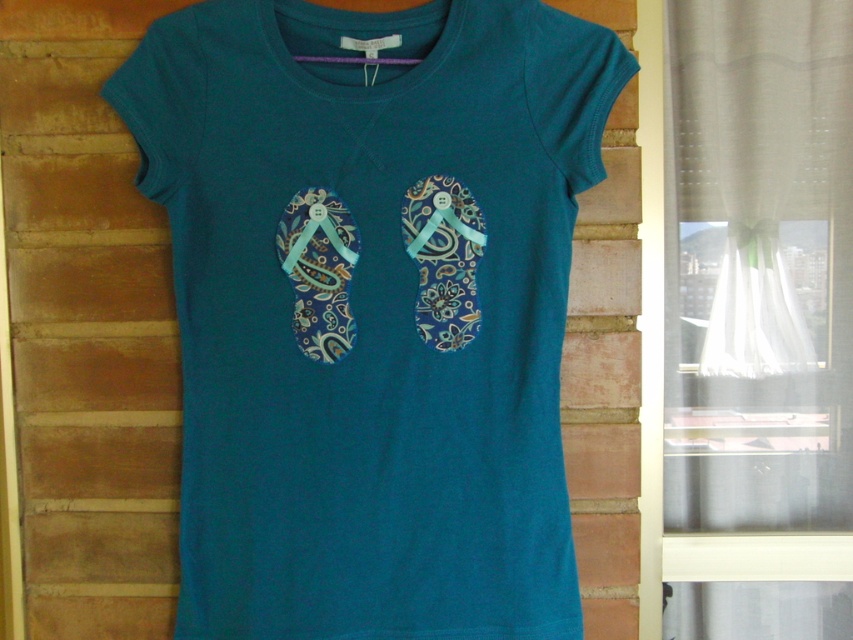
Does point (412, 42) lie behind point (364, 61)?

That is False.

Does teal fabric flip-flops at center appear under purple fabric hanger at top?

Yes, teal fabric flip-flops at center is below purple fabric hanger at top.

Which is behind, point (224, 131) or point (315, 61)?

Positioned behind is point (315, 61).

Where is `teal fabric flip-flops at center`? This screenshot has height=640, width=853. teal fabric flip-flops at center is located at coordinates (370, 308).